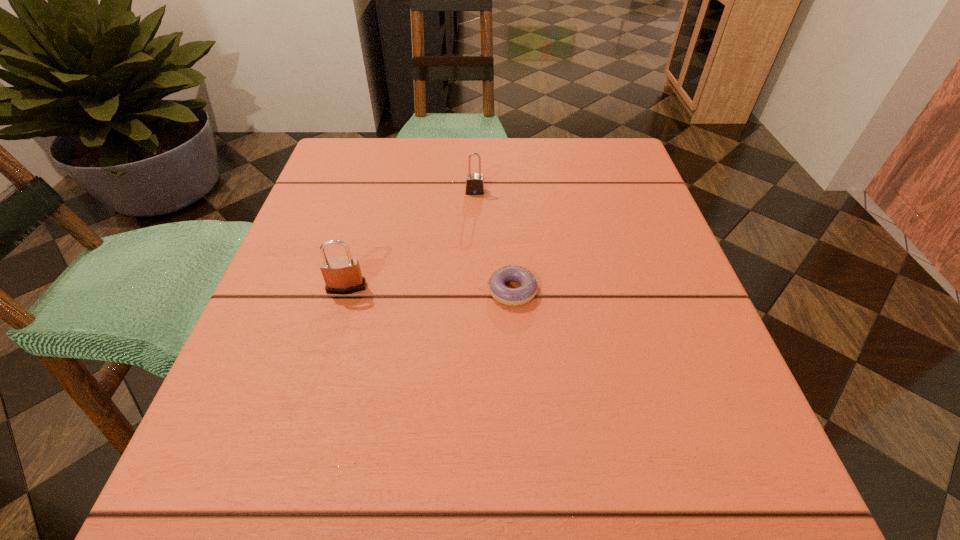
Locate an element on the screen. This screenshot has height=540, width=960. vacant space that is in between the rightmost object and the right padlock is located at coordinates (493, 241).

Find the location of a particular element. vacant point located between the leftmost object and the farther padlock is located at coordinates (411, 240).

This screenshot has width=960, height=540. I want to click on free spot between the rightmost object and the second object from right to left, so 493,241.

This screenshot has width=960, height=540. I want to click on free spot between the farthest object and the rightmost object, so click(x=493, y=241).

Locate an element on the screen. This screenshot has height=540, width=960. vacant point located between the second object from right to left and the rightmost object is located at coordinates (493, 241).

The image size is (960, 540). In order to click on unoccupied position between the doughnut and the farther padlock in this screenshot , I will do `click(493, 241)`.

Locate an element on the screen. unoccupied position between the doughnut and the left padlock is located at coordinates (429, 289).

I want to click on object that is the nearest to the rightmost object, so click(x=342, y=275).

This screenshot has height=540, width=960. Identify the location of object that is the second closest to the doughnut. (474, 185).

This screenshot has width=960, height=540. Find the location of `vacant space that satisfies the following two spatial constraints: 1. on the shackle of the shortest object; 2. on the left side of the right padlock`. vacant space that satisfies the following two spatial constraints: 1. on the shackle of the shortest object; 2. on the left side of the right padlock is located at coordinates (473, 291).